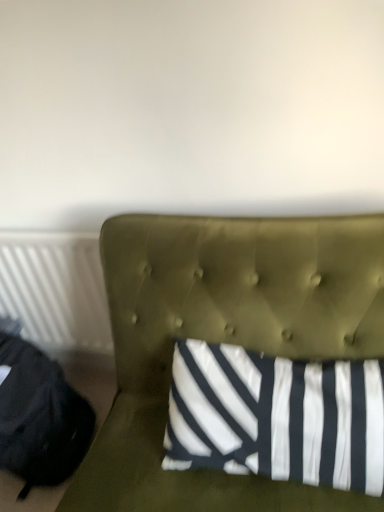
Question: Is white plastic radiator at left far away from black fabric bean bag chair at left?

Choices:
 (A) no
 (B) yes

Answer: (A)

Question: Is white plastic radiator at left wider than black fabric bean bag chair at left?

Choices:
 (A) yes
 (B) no

Answer: (B)

Question: From a real-world perspective, does white plastic radiator at left sit lower than black fabric bean bag chair at left?

Choices:
 (A) yes
 (B) no

Answer: (B)

Question: Is white plastic radiator at left at the right side of black fabric bean bag chair at left?

Choices:
 (A) yes
 (B) no

Answer: (A)

Question: Can you confirm if white plastic radiator at left is bigger than black fabric bean bag chair at left?

Choices:
 (A) no
 (B) yes

Answer: (A)

Question: Is white plastic radiator at left next to black fabric bean bag chair at left and touching it?

Choices:
 (A) yes
 (B) no

Answer: (B)

Question: From the image's perspective, is black fabric bean bag chair at left on olive green tufted headboard at center?

Choices:
 (A) yes
 (B) no

Answer: (B)

Question: Can you confirm if black fabric bean bag chair at left is smaller than olive green tufted headboard at center?

Choices:
 (A) no
 (B) yes

Answer: (B)

Question: Are black fabric bean bag chair at left and olive green tufted headboard at center beside each other?

Choices:
 (A) no
 (B) yes

Answer: (A)

Question: Considering the relative positions of black fabric bean bag chair at left and olive green tufted headboard at center in the image provided, is black fabric bean bag chair at left to the left of olive green tufted headboard at center from the viewer's perspective?

Choices:
 (A) no
 (B) yes

Answer: (B)

Question: Is olive green tufted headboard at center a part of black fabric bean bag chair at left?

Choices:
 (A) yes
 (B) no

Answer: (B)

Question: Does black fabric bean bag chair at left have a greater width compared to olive green tufted headboard at center?

Choices:
 (A) yes
 (B) no

Answer: (B)

Question: Does black fabric bean bag chair at left have a greater height compared to white plastic radiator at left?

Choices:
 (A) no
 (B) yes

Answer: (A)